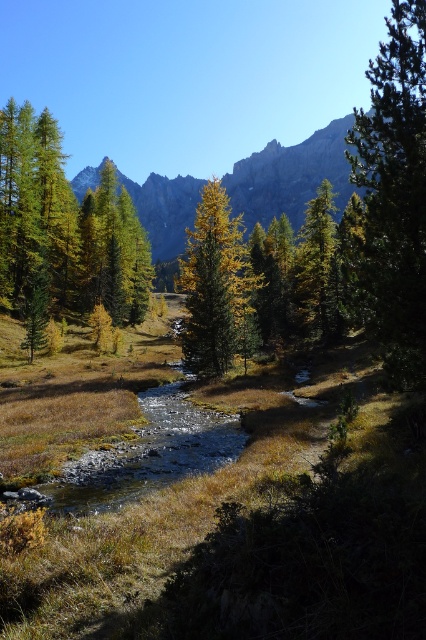
Question: Can you confirm if green matte tree at left is wider than green textured pine tree at upper right?

Choices:
 (A) no
 (B) yes

Answer: (A)

Question: Based on their relative distances, which object is nearer to the green matte tree at center?

Choices:
 (A) green matte tree at left
 (B) green textured pine tree at upper right
 (C) green leafy trees at upper center
 (D) golden-green foliage at center

Answer: (B)

Question: Can you confirm if green matte tree at left is smaller than green leafy trees at upper center?

Choices:
 (A) yes
 (B) no

Answer: (A)

Question: Which point appears farthest from the camera in this image?

Choices:
 (A) (405, 108)
 (B) (120, 273)
 (C) (305, 260)
 (D) (193, 310)

Answer: (B)

Question: Which object appears farthest from the camera in this image?

Choices:
 (A) green textured pine tree at upper right
 (B) golden-green foliage at center

Answer: (B)

Question: Does green matte tree at left appear on the left side of green textured pine tree at upper right?

Choices:
 (A) yes
 (B) no

Answer: (A)